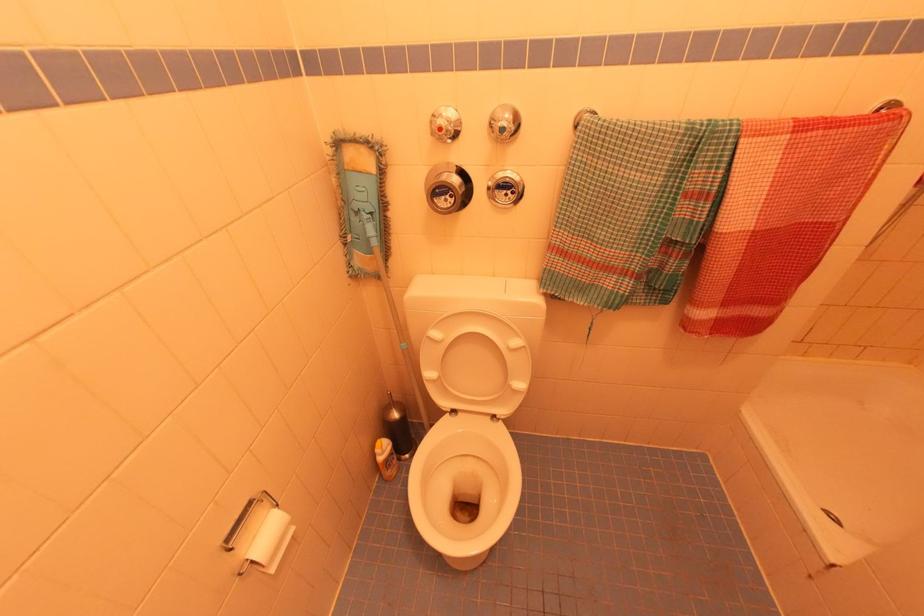
Find the location of `silver shower knob`. silver shower knob is located at coordinates (444, 123).